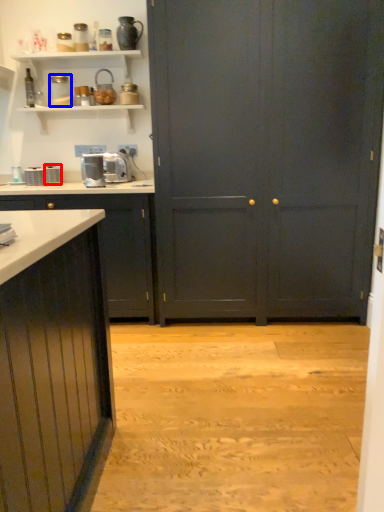
Question: Which of the following is the closest to the observer, appliance (highlighted by a red box) or appliance (highlighted by a blue box)?

Choices:
 (A) appliance
 (B) appliance

Answer: (B)